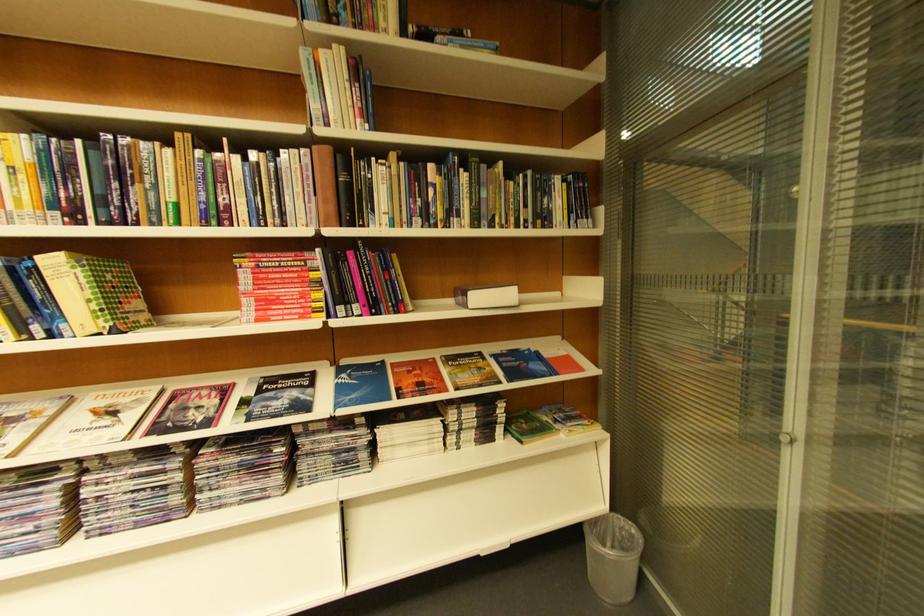
What do you see at coordinates (94, 293) in the screenshot? I see `the green spine book` at bounding box center [94, 293].